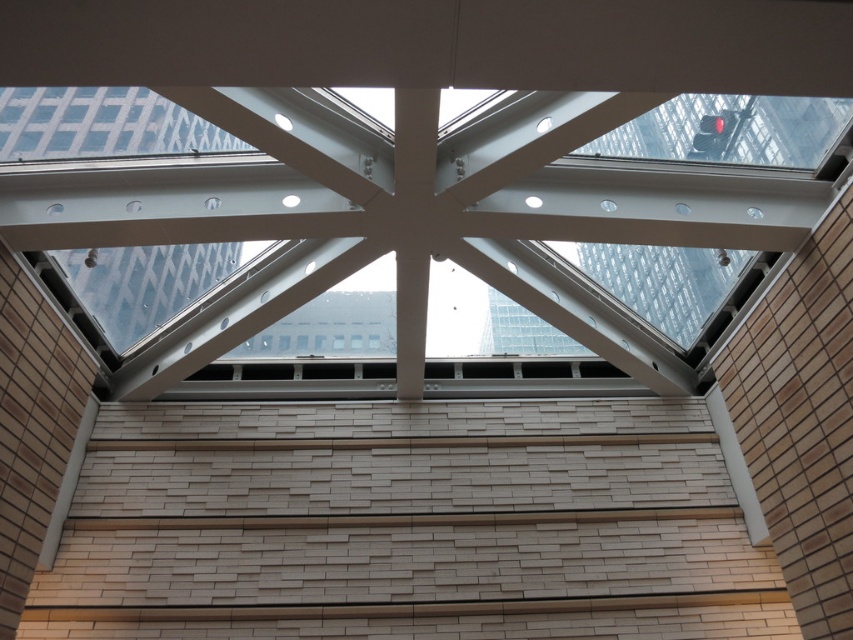
Question: Does white glass window at center have a smaller size compared to transparent glass window at upper left?

Choices:
 (A) no
 (B) yes

Answer: (A)

Question: Which object appears closest to the camera in this image?

Choices:
 (A) transparent glass window at upper left
 (B) white glass window at center

Answer: (B)

Question: Does white glass window at center appear on the right side of transparent glass window at upper left?

Choices:
 (A) yes
 (B) no

Answer: (A)

Question: Which object is closer to the camera taking this photo?

Choices:
 (A) white glass window at center
 (B) transparent glass window at upper left

Answer: (A)

Question: Does white glass window at center have a greater width compared to transparent glass window at upper left?

Choices:
 (A) no
 (B) yes

Answer: (B)